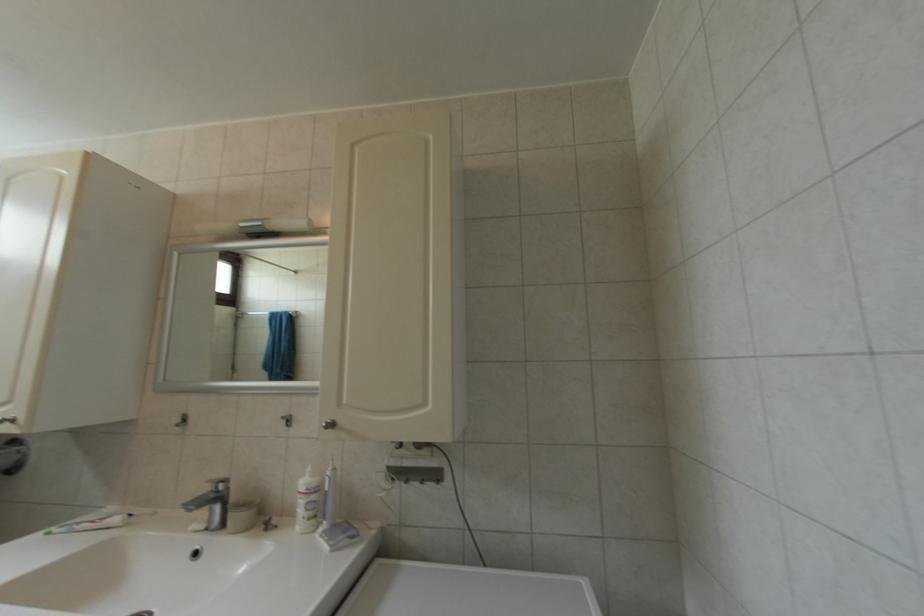
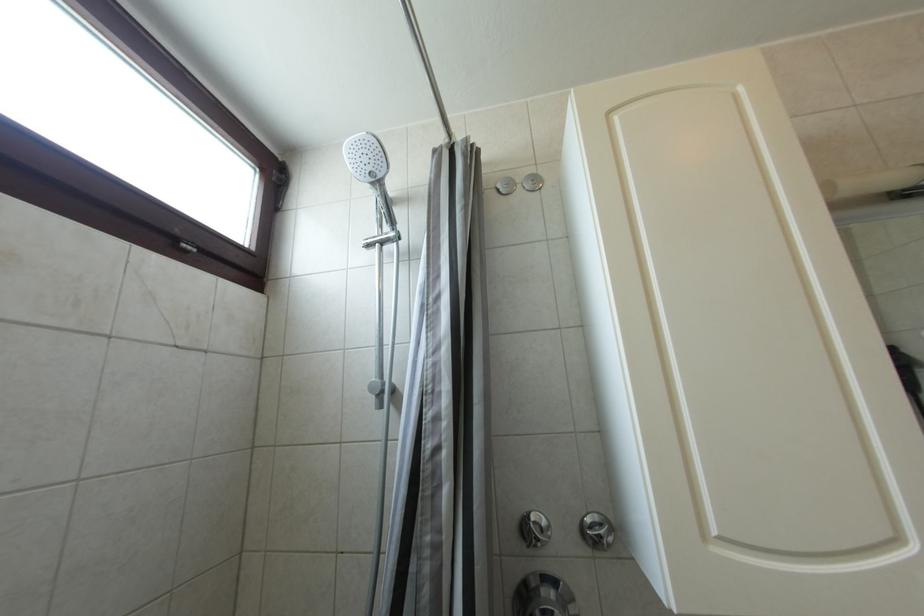
Question: The images are taken continuously from a first-person perspective. In which direction are you moving?

Choices:
 (A) Left
 (B) Right
 (C) Forward
 (D) Backward

Answer: (A)